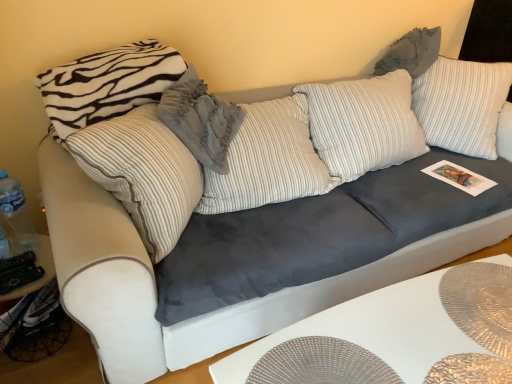
I want to click on velvety gray pillow at center, marked as the 2th pillow in a left-to-right arrangement, so click(x=200, y=120).

Describe the element at coordinates (395, 335) in the screenshot. I see `white textured placemat at lower right` at that location.

Find the location of a particular element. velvety gray pillow at center, placed as the second pillow when sorted from right to left is located at coordinates (200, 120).

From a real-world perspective, between velvety gray pillow at center, placed as the second pillow when sorted from right to left, and white striped pillow at upper left, which is the 1th pillow in left-to-right order, who is vertically lower?

velvety gray pillow at center, placed as the second pillow when sorted from right to left.

Considering the relative sizes of velvety gray pillow at center, marked as the 2th pillow in a left-to-right arrangement, and white striped pillow at upper left, positioned as the 3th pillow in right-to-left order, in the image provided, is velvety gray pillow at center, marked as the 2th pillow in a left-to-right arrangement, wider than white striped pillow at upper left, positioned as the 3th pillow in right-to-left order,?

Yes.

Does white textured placemat at lower right have a lesser height compared to white striped pillow at upper left, which is the 1th pillow in left-to-right order?

In fact, white textured placemat at lower right may be taller than white striped pillow at upper left, which is the 1th pillow in left-to-right order.

Does white textured placemat at lower right have a smaller size compared to white striped pillow at upper left, which is the 1th pillow in left-to-right order?

No, white textured placemat at lower right is not smaller than white striped pillow at upper left, which is the 1th pillow in left-to-right order.

Is white textured placemat at lower right turned away from gray textured pillow at upper right, placed as the 1th pillow when sorted from right to left?

No.

Choose the correct answer: Is white textured placemat at lower right inside gray textured pillow at upper right, placed as the 1th pillow when sorted from right to left, or outside it?

white textured placemat at lower right cannot be found inside gray textured pillow at upper right, placed as the 1th pillow when sorted from right to left.

From a real-world perspective, starting from the white textured placemat at lower right, which pillow is the 3rd one vertically above it? Please provide its 2D coordinates.

[(411, 52)]

Considering the sizes of objects gray textured pillow at upper right, which is counted as the third pillow, starting from the left, and velvety gray pillow at center, marked as the 2th pillow in a left-to-right arrangement, in the image provided, who is wider, gray textured pillow at upper right, which is counted as the third pillow, starting from the left, or velvety gray pillow at center, marked as the 2th pillow in a left-to-right arrangement,?

Wider between the two is velvety gray pillow at center, marked as the 2th pillow in a left-to-right arrangement.

Between gray textured pillow at upper right, which is counted as the third pillow, starting from the left, and velvety gray pillow at center, placed as the second pillow when sorted from right to left, which one is positioned behind?

gray textured pillow at upper right, which is counted as the third pillow, starting from the left.

Could velvety gray pillow at center, marked as the 2th pillow in a left-to-right arrangement, be considered to be inside gray textured pillow at upper right, placed as the 1th pillow when sorted from right to left?

No, velvety gray pillow at center, marked as the 2th pillow in a left-to-right arrangement, is not surrounded by gray textured pillow at upper right, placed as the 1th pillow when sorted from right to left.

How many degrees apart are the facing directions of gray textured pillow at upper right, placed as the 1th pillow when sorted from right to left, and velvety gray pillow at center, marked as the 2th pillow in a left-to-right arrangement?

The angle between the facing direction of gray textured pillow at upper right, placed as the 1th pillow when sorted from right to left, and the facing direction of velvety gray pillow at center, marked as the 2th pillow in a left-to-right arrangement, is 51.7 degrees.

Can you tell me how much velvety gray pillow at center, marked as the 2th pillow in a left-to-right arrangement, and white textured placemat at lower right differ in facing direction?

52.8 degrees.

Is white textured placemat at lower right at the back of velvety gray pillow at center, placed as the second pillow when sorted from right to left?

No, velvety gray pillow at center, placed as the second pillow when sorted from right to left, is not facing away from white textured placemat at lower right.

From the image's perspective, which one is positioned higher, velvety gray pillow at center, marked as the 2th pillow in a left-to-right arrangement, or white textured placemat at lower right?

velvety gray pillow at center, marked as the 2th pillow in a left-to-right arrangement.

Is velvety gray pillow at center, marked as the 2th pillow in a left-to-right arrangement, located outside white textured placemat at lower right?

Yes, velvety gray pillow at center, marked as the 2th pillow in a left-to-right arrangement, is outside of white textured placemat at lower right.

Is point (353, 352) behind point (216, 111)?

No, it is not.

Is white textured placemat at lower right bigger or smaller than velvety gray pillow at center, placed as the second pillow when sorted from right to left?

In the image, white textured placemat at lower right appears to be larger than velvety gray pillow at center, placed as the second pillow when sorted from right to left.

Is white textured placemat at lower right positioned with its back to velvety gray pillow at center, placed as the second pillow when sorted from right to left?

white textured placemat at lower right does not have its back to velvety gray pillow at center, placed as the second pillow when sorted from right to left.

Is gray textured pillow at upper right, which is counted as the third pillow, starting from the left, positioned with its back to white striped pillow at upper left, which is the 1th pillow in left-to-right order?

That's not correct — gray textured pillow at upper right, which is counted as the third pillow, starting from the left, is not looking away from white striped pillow at upper left, which is the 1th pillow in left-to-right order.

Considering the sizes of objects gray textured pillow at upper right, which is counted as the third pillow, starting from the left, and white striped pillow at upper left, which is the 1th pillow in left-to-right order, in the image provided, who is smaller, gray textured pillow at upper right, which is counted as the third pillow, starting from the left, or white striped pillow at upper left, which is the 1th pillow in left-to-right order,?

Smaller between the two is gray textured pillow at upper right, which is counted as the third pillow, starting from the left.

In the scene shown: Which is behind, gray textured pillow at upper right, which is counted as the third pillow, starting from the left, or white striped pillow at upper left, which is the 1th pillow in left-to-right order?

gray textured pillow at upper right, which is counted as the third pillow, starting from the left, is more distant.

You are a GUI agent. You are given a task and a screenshot of the screen. Output one action in this format:
    pyautogui.click(x=<x>, y=<y>)
    Task: Click on the pillow below the white striped pillow at upper left, which is the 1th pillow in left-to-right order (from a real-world perspective)
    Image resolution: width=512 pixels, height=384 pixels.
    Given the screenshot: What is the action you would take?
    pyautogui.click(x=200, y=120)

Identify the location of table that is in front of the white striped pillow at upper left, which is the 1th pillow in left-to-right order. (395, 335).

When comparing their distances from white striped pillow at upper left, which is the 1th pillow in left-to-right order, does white textured placemat at lower right or velvety gray pillow at center, marked as the 2th pillow in a left-to-right arrangement, seem further?

white textured placemat at lower right is positioned further to the anchor white striped pillow at upper left, which is the 1th pillow in left-to-right order.

From the image, which object appears to be farther from white textured placemat at lower right, gray textured pillow at upper right, which is counted as the third pillow, starting from the left, or white striped pillow at upper left, which is the 1th pillow in left-to-right order?

Based on the image, gray textured pillow at upper right, which is counted as the third pillow, starting from the left, appears to be further to white textured placemat at lower right.

From the image, which object appears to be farther from white textured placemat at lower right, velvety gray pillow at center, placed as the second pillow when sorted from right to left, or gray textured pillow at upper right, which is counted as the third pillow, starting from the left?

gray textured pillow at upper right, which is counted as the third pillow, starting from the left.

Based on their spatial positions, is velvety gray pillow at center, marked as the 2th pillow in a left-to-right arrangement, or white textured placemat at lower right further from white striped pillow at upper left, positioned as the 3th pillow in right-to-left order?

Among the two, white textured placemat at lower right is located further to white striped pillow at upper left, positioned as the 3th pillow in right-to-left order.

From the picture: From the image, which object appears to be farther from velvety gray pillow at center, placed as the second pillow when sorted from right to left, white textured placemat at lower right or white striped pillow at upper left, positioned as the 3th pillow in right-to-left order?

Based on the image, white textured placemat at lower right appears to be further to velvety gray pillow at center, placed as the second pillow when sorted from right to left.

Based on their spatial positions, is white textured placemat at lower right or velvety gray pillow at center, placed as the second pillow when sorted from right to left, further from gray textured pillow at upper right, which is counted as the third pillow, starting from the left?

Among the two, white textured placemat at lower right is located further to gray textured pillow at upper right, which is counted as the third pillow, starting from the left.

When comparing their distances from gray textured pillow at upper right, placed as the 1th pillow when sorted from right to left, does white textured placemat at lower right or white striped pillow at upper left, which is the 1th pillow in left-to-right order, seem closer?

The object closer to gray textured pillow at upper right, placed as the 1th pillow when sorted from right to left, is white striped pillow at upper left, which is the 1th pillow in left-to-right order.

From the image, which object appears to be farther from white striped pillow at upper left, which is the 1th pillow in left-to-right order, gray textured pillow at upper right, placed as the 1th pillow when sorted from right to left, or white textured placemat at lower right?

Among the two, gray textured pillow at upper right, placed as the 1th pillow when sorted from right to left, is located further to white striped pillow at upper left, which is the 1th pillow in left-to-right order.

Locate an element on the screen. table between white striped pillow at upper left, which is the 1th pillow in left-to-right order, and gray textured pillow at upper right, placed as the 1th pillow when sorted from right to left, from left to right is located at coordinates (395, 335).

Locate an element on the screen. The height and width of the screenshot is (384, 512). pillow between white striped pillow at upper left, which is the 1th pillow in left-to-right order, and white textured placemat at lower right vertically is located at coordinates (200, 120).

You are a GUI agent. You are given a task and a screenshot of the screen. Output one action in this format:
    pyautogui.click(x=<x>, y=<y>)
    Task: Click on the pillow between white striped pillow at upper left, which is the 1th pillow in left-to-right order, and gray textured pillow at upper right, placed as the 1th pillow when sorted from right to left, in the horizontal direction
    
    Given the screenshot: What is the action you would take?
    pyautogui.click(x=200, y=120)